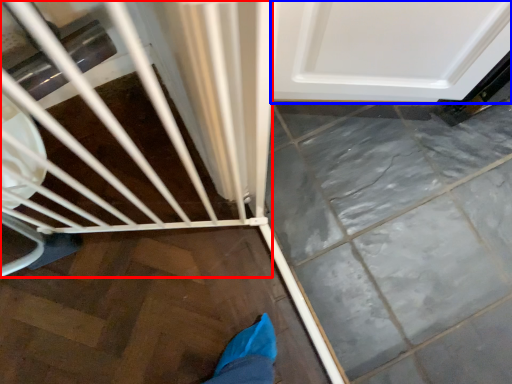
Question: Which point is further to the camera, baby carriage (highlighted by a red box) or door (highlighted by a blue box)?

Choices:
 (A) baby carriage
 (B) door

Answer: (B)